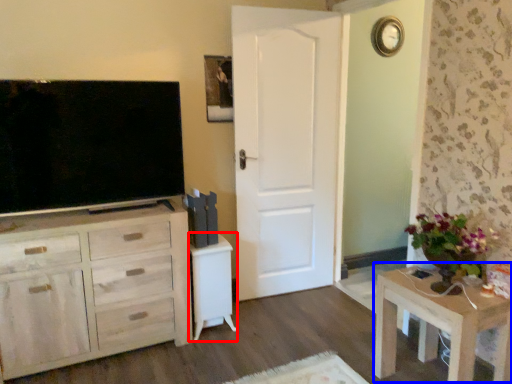
Question: Which point is closer to the camera, vanity (highlighted by a red box) or table (highlighted by a blue box)?

Choices:
 (A) vanity
 (B) table

Answer: (B)